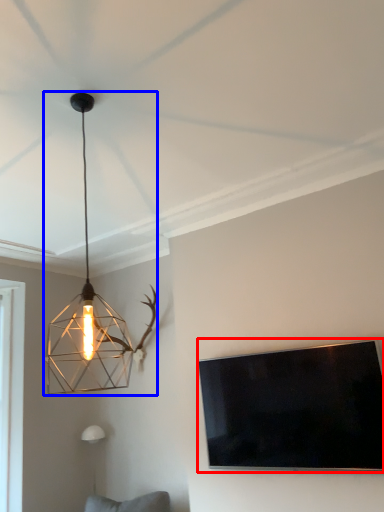
Question: Which of the following is the farthest to the observer, television (highlighted by a red box) or lamp (highlighted by a blue box)?

Choices:
 (A) television
 (B) lamp

Answer: (A)